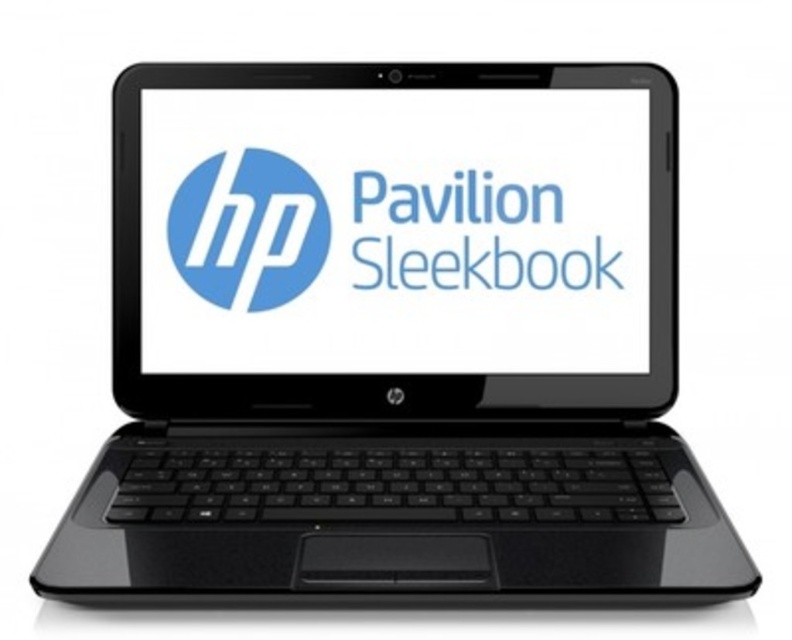
Between point (638, 141) and point (252, 230), which one is positioned behind?

Positioned behind is point (252, 230).

This screenshot has width=792, height=640. Find the location of `matte black screen at center`. matte black screen at center is located at coordinates (394, 230).

This screenshot has height=640, width=792. What are the coordinates of `matte black screen at center` in the screenshot? It's located at (394, 230).

Who is more distant from viewer, [329,164] or [377,237]?

The point [377,237] is more distant.

Can you confirm if matte black screen at center is taller than blue glossy pavilion sleekbook at center?

Correct, matte black screen at center is much taller as blue glossy pavilion sleekbook at center.

Which is behind, point (292, 285) or point (478, 192)?

The point (478, 192) is more distant.

At what (x,y) coordinates should I click in order to perform the action: click on matte black screen at center. Please return your answer as a coordinate pair (x, y). The image size is (792, 640). Looking at the image, I should click on (394, 230).

Between matte blue circle at center and blue glossy pavilion sleekbook at center, which one is positioned higher?

matte blue circle at center is above.

Does matte blue circle at center have a larger size compared to blue glossy pavilion sleekbook at center?

No.

The width and height of the screenshot is (792, 640). Describe the element at coordinates (248, 228) in the screenshot. I see `matte blue circle at center` at that location.

This screenshot has height=640, width=792. I want to click on matte blue circle at center, so click(248, 228).